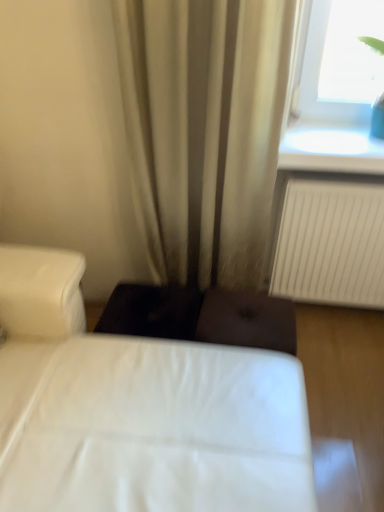
Question: Considering the relative sizes of white fabric bed at center and beige fabric curtain at center in the image provided, is white fabric bed at center thinner than beige fabric curtain at center?

Choices:
 (A) no
 (B) yes

Answer: (A)

Question: Is white fabric bed at center directly adjacent to beige fabric curtain at center?

Choices:
 (A) no
 (B) yes

Answer: (A)

Question: Considering the relative sizes of white fabric bed at center and beige fabric curtain at center in the image provided, is white fabric bed at center bigger than beige fabric curtain at center?

Choices:
 (A) yes
 (B) no

Answer: (A)

Question: From a real-world perspective, is white fabric bed at center physically above beige fabric curtain at center?

Choices:
 (A) no
 (B) yes

Answer: (A)

Question: From the image's perspective, is white fabric bed at center above beige fabric curtain at center?

Choices:
 (A) yes
 (B) no

Answer: (B)

Question: Visually, is beige fabric curtain at center positioned to the left or to the right of transparent glass at upper right?

Choices:
 (A) right
 (B) left

Answer: (B)

Question: From the image's perspective, is beige fabric curtain at center located above or below transparent glass at upper right?

Choices:
 (A) below
 (B) above

Answer: (A)

Question: In terms of height, does beige fabric curtain at center look taller or shorter compared to transparent glass at upper right?

Choices:
 (A) short
 (B) tall

Answer: (B)

Question: Relative to transparent glass at upper right, is beige fabric curtain at center in front or behind?

Choices:
 (A) behind
 (B) front

Answer: (B)

Question: In terms of height, does transparent glass at upper right look taller or shorter compared to white fabric bed at center?

Choices:
 (A) tall
 (B) short

Answer: (B)

Question: Considering their positions, is transparent glass at upper right located in front of or behind white fabric bed at center?

Choices:
 (A) front
 (B) behind

Answer: (B)

Question: In terms of width, does transparent glass at upper right look wider or thinner when compared to white fabric bed at center?

Choices:
 (A) thin
 (B) wide

Answer: (A)

Question: Is point (329, 48) closer or farther from the camera than point (170, 347)?

Choices:
 (A) farther
 (B) closer

Answer: (A)

Question: Would you say transparent glass at upper right is to the left or to the right of beige fabric curtain at center in the picture?

Choices:
 (A) left
 (B) right

Answer: (B)

Question: Would you say transparent glass at upper right is inside or outside beige fabric curtain at center?

Choices:
 (A) inside
 (B) outside

Answer: (B)